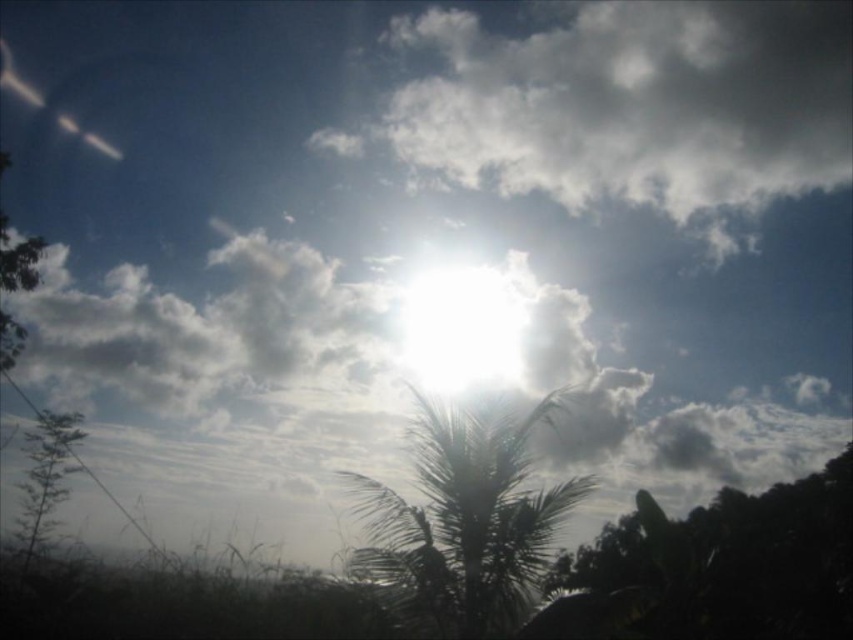
You are standing in a garden where the sun is casting strong shadows. You need to place a large garden bench between the green leafy tree at lower right and the green leafy plant at lower left. Based on their sizes, which side should the bench be closer to?

The green leafy tree at lower right might be wider than the green leafy plant at lower left, so the bench should be placed closer to the green leafy plant at lower left to avoid the wider tree casting too much shadow over the bench.

You are standing in a garden and see the green leafy tree at lower right and the green leafy plant at lower left. Which one is located to the right side of the other?

The green leafy tree at lower right is positioned on the right side of the green leafy plant at lower left.

You are standing in front of the sky scene and want to take a photo. There are two points marked in the image, point A at coordinates point [811,632] and point B at coordinates point [68,420]. Which point is closer to your camera lens?

Point [811,632] is closer to the camera than point [68,420], so point A is closer to your camera lens.